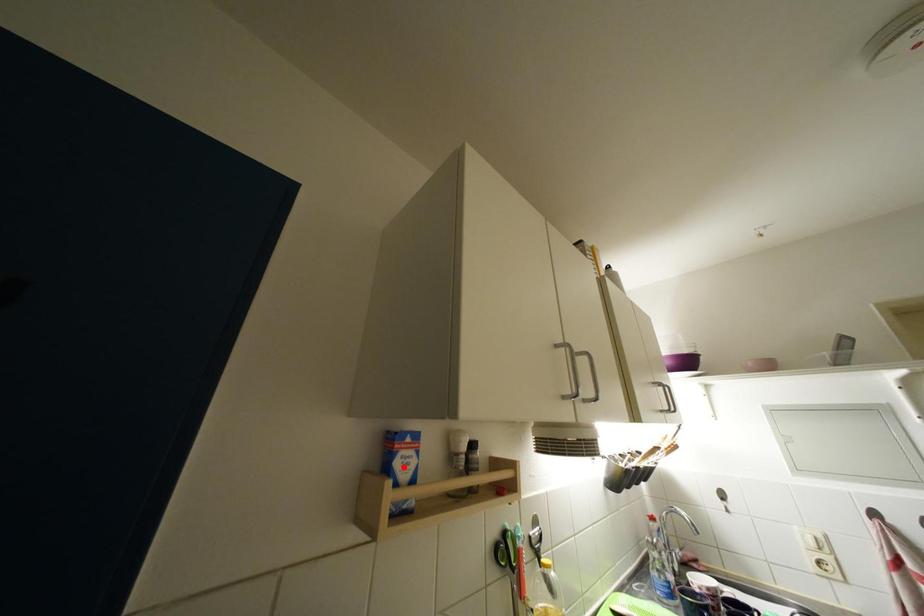
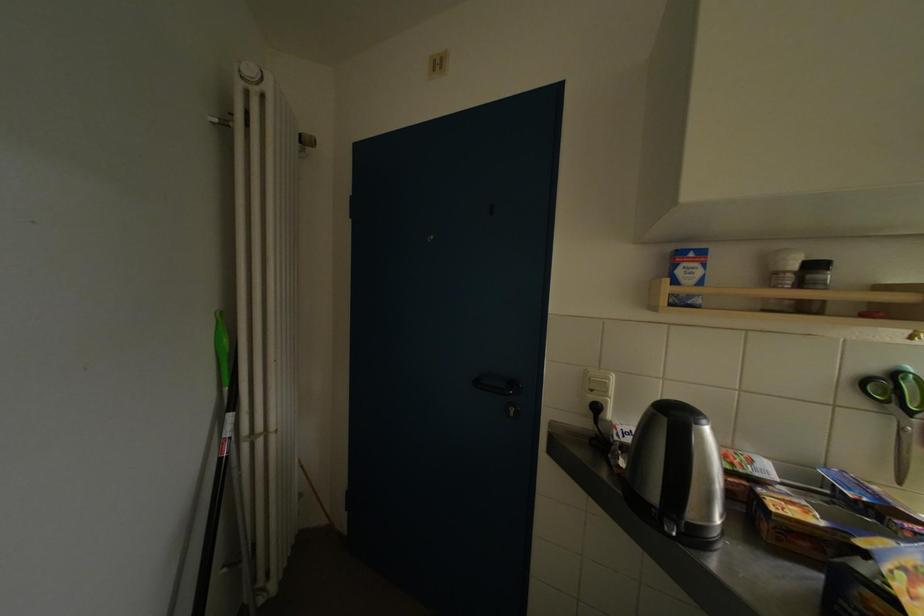
Locate, in the second image, the point that corresponds to the highlighted location in the first image.

(686, 276)